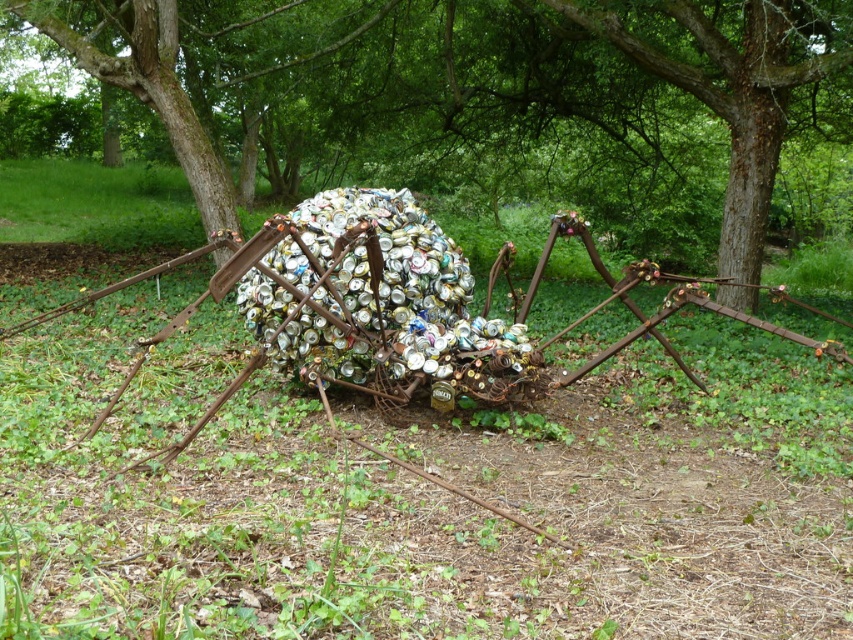
Question: Does brown wood tree at center have a lesser width compared to rusty metal spider at center?

Choices:
 (A) no
 (B) yes

Answer: (A)

Question: Which object is closer to the camera taking this photo?

Choices:
 (A) rusty metal spider at center
 (B) brown wood tree at center

Answer: (A)

Question: Is brown wood tree at center behind rusty metal spider at center?

Choices:
 (A) no
 (B) yes

Answer: (B)

Question: Can you confirm if brown wood tree at center is positioned below rusty metal spider at center?

Choices:
 (A) yes
 (B) no

Answer: (B)

Question: Among these objects, which one is farthest from the camera?

Choices:
 (A) rusty metal spider at center
 (B) brown wood tree at center

Answer: (B)

Question: Which point is closer to the camera?

Choices:
 (A) brown wood tree at center
 (B) rusty metal spider at center

Answer: (B)